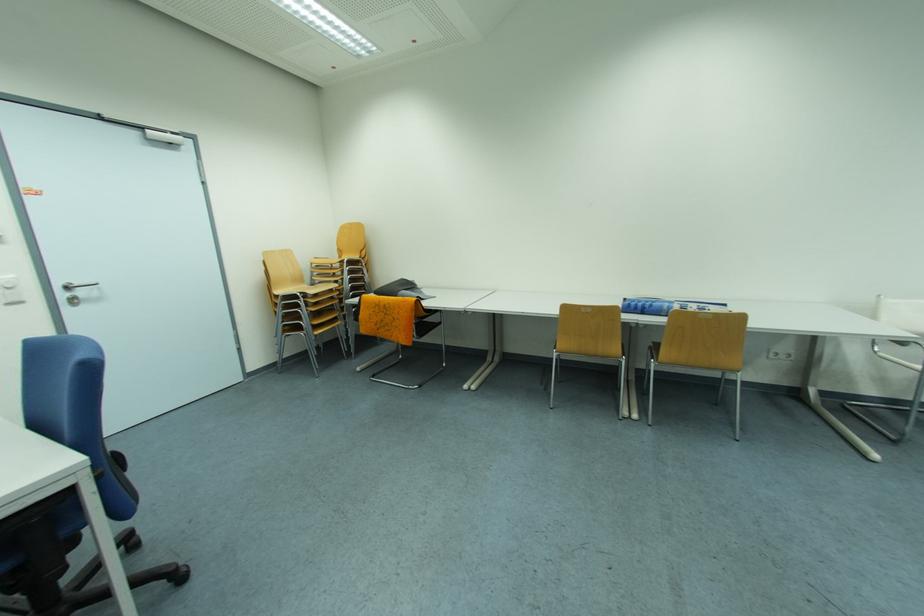
Which object does [666,306] point to?

This point indicates the blue binder.